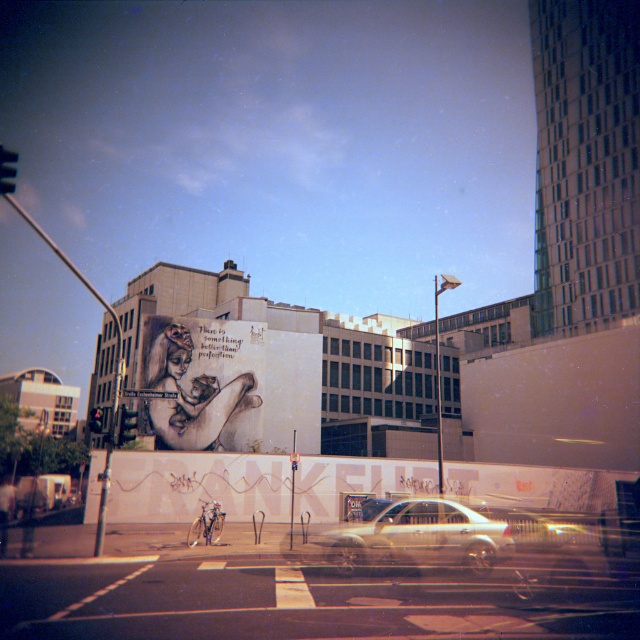
Question: Can you confirm if matte white mural at center is thinner than metallic silver sedan at center?

Choices:
 (A) no
 (B) yes

Answer: (A)

Question: Is matte white mural at center wider than metallic silver sedan at center?

Choices:
 (A) yes
 (B) no

Answer: (A)

Question: Is matte white mural at center in front of metallic silver sedan at center?

Choices:
 (A) yes
 (B) no

Answer: (B)